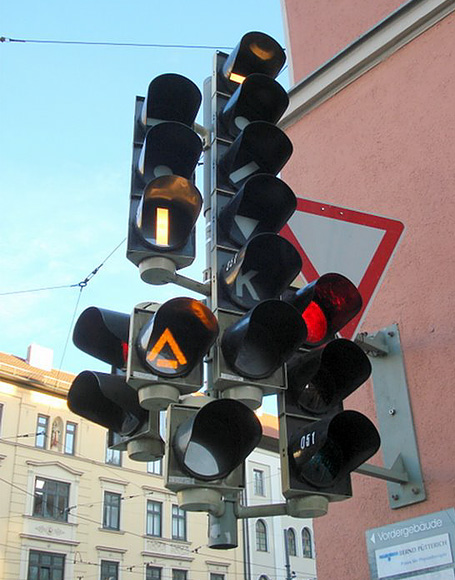
Where is `pink wall`? Image resolution: width=455 pixels, height=580 pixels. pink wall is located at coordinates (369, 135), (447, 351).